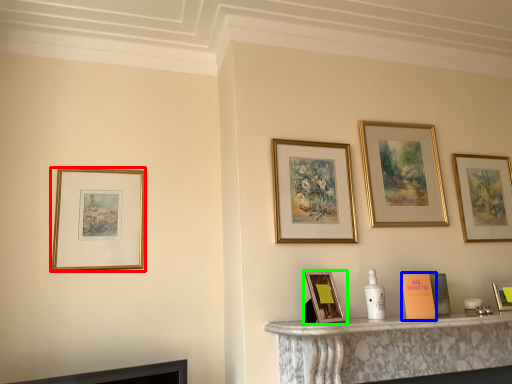
Question: Which object is positioned farthest from picture frame (highlighted by a red box)? Select from book (highlighted by a blue box) and picture frame (highlighted by a green box).

Choices:
 (A) book
 (B) picture frame

Answer: (A)